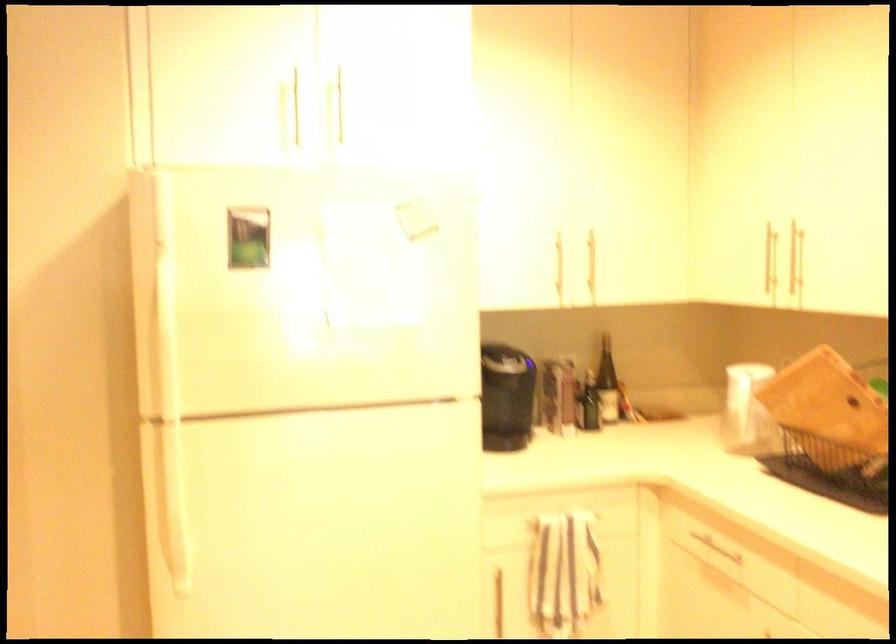
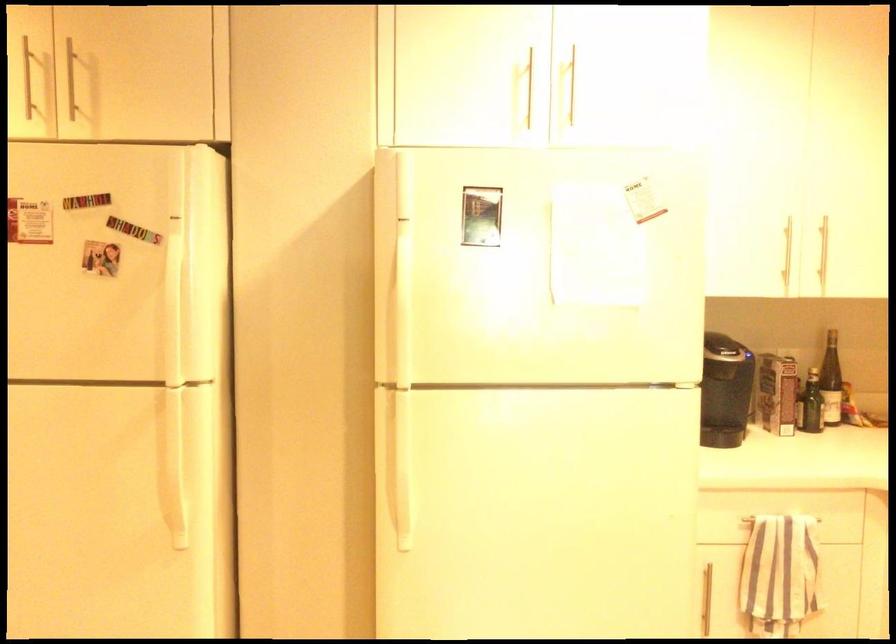
Find the pixel in the second image that matches pixel 158 328 in the first image.

(401, 298)